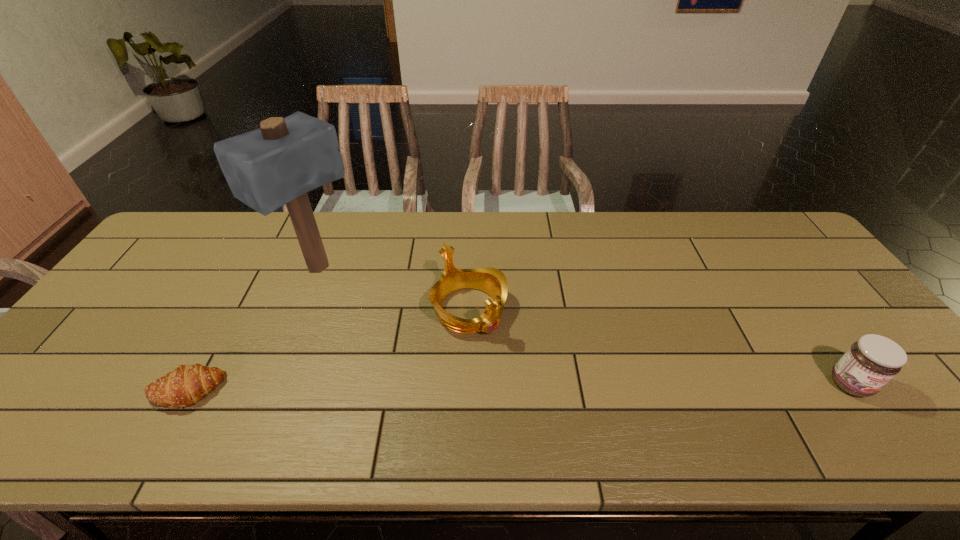
This screenshot has width=960, height=540. What are the coordinates of `the closest object to the third object from left to right` in the screenshot? It's located at (277, 164).

Locate an element on the screen. The image size is (960, 540). the closest object relative to the second object from right to left is located at coordinates (277, 164).

The width and height of the screenshot is (960, 540). What are the coordinates of `vacant space that satisfies the following two spatial constraints: 1. on the back side of the tiara; 2. on the left side of the shortest object` in the screenshot? It's located at (230, 310).

Find the location of `vacant region that satisfies the following two spatial constraints: 1. on the back side of the second object from right to left; 2. on the right side of the shortest object`. vacant region that satisfies the following two spatial constraints: 1. on the back side of the second object from right to left; 2. on the right side of the shortest object is located at coordinates (230, 310).